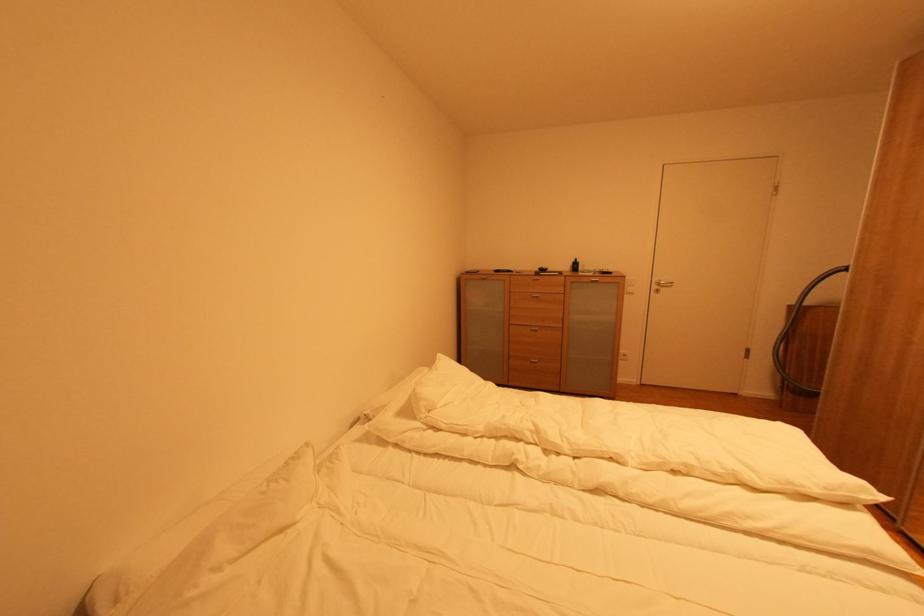
Describe the element at coordinates (532, 331) in the screenshot. I see `the metal cabinet handle` at that location.